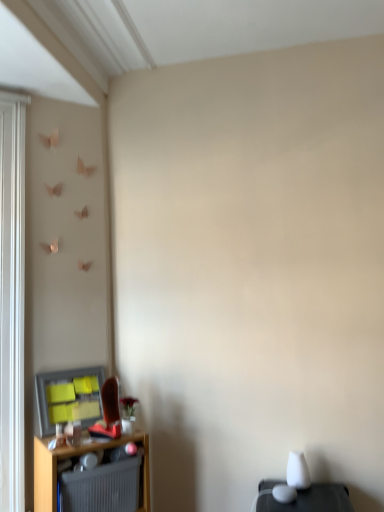
The width and height of the screenshot is (384, 512). In order to click on wooden shelf at lower left in this screenshot , I will do `click(73, 456)`.

Where is `matte plastic window screen at lower left`? matte plastic window screen at lower left is located at coordinates (69, 397).

Does wooden shelf at lower left lie in front of matte plastic window screen at lower left?

Yes.

From a real-world perspective, does wooden shelf at lower left stand above matte plastic window screen at lower left?

No, from a real-world perspective, wooden shelf at lower left is not over matte plastic window screen at lower left

Are wooden shelf at lower left and matte plastic window screen at lower left beside each other?

wooden shelf at lower left and matte plastic window screen at lower left are not in contact.

Based on the photo, from the image's perspective, is wooden shelf at lower left located above matte plastic window screen at lower left?

No, from the image's perspective, wooden shelf at lower left is not on top of matte plastic window screen at lower left.

In terms of height, does matte plastic window screen at lower left look taller or shorter compared to wooden shelf at lower left?

matte plastic window screen at lower left is shorter than wooden shelf at lower left.

Considering the points (71, 404) and (51, 475), which point is behind, point (71, 404) or point (51, 475)?

The point (71, 404) is farther.

Considering the relative sizes of matte plastic window screen at lower left and wooden shelf at lower left in the image provided, is matte plastic window screen at lower left wider than wooden shelf at lower left?

No, matte plastic window screen at lower left is not wider than wooden shelf at lower left.

Between gray ribbed radiator at lower left and wooden shelf at lower left, which one has more height?

wooden shelf at lower left is taller.

Is gray ribbed radiator at lower left far away from wooden shelf at lower left?

That's not correct — gray ribbed radiator at lower left is a little close to wooden shelf at lower left.

From a real-world perspective, is gray ribbed radiator at lower left physically located above or below wooden shelf at lower left?

gray ribbed radiator at lower left is situated higher than wooden shelf at lower left in the real world.

Is matte plastic window screen at lower left not inside gray ribbed radiator at lower left?

That's correct, matte plastic window screen at lower left is outside of gray ribbed radiator at lower left.

Is matte plastic window screen at lower left smaller than gray ribbed radiator at lower left?

Yes, matte plastic window screen at lower left is smaller than gray ribbed radiator at lower left.

Consider the image. From a real-world perspective, who is located higher, matte plastic window screen at lower left or gray ribbed radiator at lower left?

matte plastic window screen at lower left, from a real-world perspective.

From a real-world perspective, is wooden shelf at lower left beneath gray ribbed radiator at lower left?

Indeed, from a real-world perspective, wooden shelf at lower left is positioned beneath gray ribbed radiator at lower left.

Is wooden shelf at lower left positioned beyond the bounds of gray ribbed radiator at lower left?

No, wooden shelf at lower left is inside or overlapping with gray ribbed radiator at lower left.

Identify the location of shelf below the gray ribbed radiator at lower left (from the image's perspective). (73, 456).

In the image, is wooden shelf at lower left positioned in front of or behind gray ribbed radiator at lower left?

Clearly, wooden shelf at lower left is in front of gray ribbed radiator at lower left.

Between gray ribbed radiator at lower left and matte plastic window screen at lower left, which one is positioned behind?

matte plastic window screen at lower left is more distant.

Is point (66, 473) farther from camera compared to point (90, 424)?

That is False.

Is gray ribbed radiator at lower left directly adjacent to matte plastic window screen at lower left?

gray ribbed radiator at lower left and matte plastic window screen at lower left are not in contact.

Is gray ribbed radiator at lower left facing towards matte plastic window screen at lower left?

No, gray ribbed radiator at lower left is not oriented towards matte plastic window screen at lower left.

You are a GUI agent. You are given a task and a screenshot of the screen. Output one action in this format:
    pyautogui.click(x=<x>, y=<y>)
    Task: Click on the shelf in front of the matte plastic window screen at lower left
    
    Given the screenshot: What is the action you would take?
    pyautogui.click(x=73, y=456)

Locate an element on the screen. The height and width of the screenshot is (512, 384). window screen lying behind the wooden shelf at lower left is located at coordinates (69, 397).

Based on their spatial positions, is wooden shelf at lower left or matte plastic window screen at lower left further from gray ribbed radiator at lower left?

Based on the image, matte plastic window screen at lower left appears to be further to gray ribbed radiator at lower left.

Estimate the real-world distances between objects in this image. Which object is further from matte plastic window screen at lower left, gray ribbed radiator at lower left or wooden shelf at lower left?

Based on the image, gray ribbed radiator at lower left appears to be further to matte plastic window screen at lower left.

Based on their spatial positions, is wooden shelf at lower left or gray ribbed radiator at lower left closer to matte plastic window screen at lower left?

wooden shelf at lower left lies closer to matte plastic window screen at lower left than the other object.

Looking at this image, considering their positions, is gray ribbed radiator at lower left positioned further to wooden shelf at lower left than matte plastic window screen at lower left?

matte plastic window screen at lower left.

From the image, which object appears to be farther from gray ribbed radiator at lower left, matte plastic window screen at lower left or wooden shelf at lower left?

matte plastic window screen at lower left is further to gray ribbed radiator at lower left.

Considering their positions, is matte plastic window screen at lower left positioned further to wooden shelf at lower left than gray ribbed radiator at lower left?

Based on the image, matte plastic window screen at lower left appears to be further to wooden shelf at lower left.

Find the location of `radiator between matte plastic window screen at lower left and wooden shelf at lower left vertically`. radiator between matte plastic window screen at lower left and wooden shelf at lower left vertically is located at coordinates (101, 487).